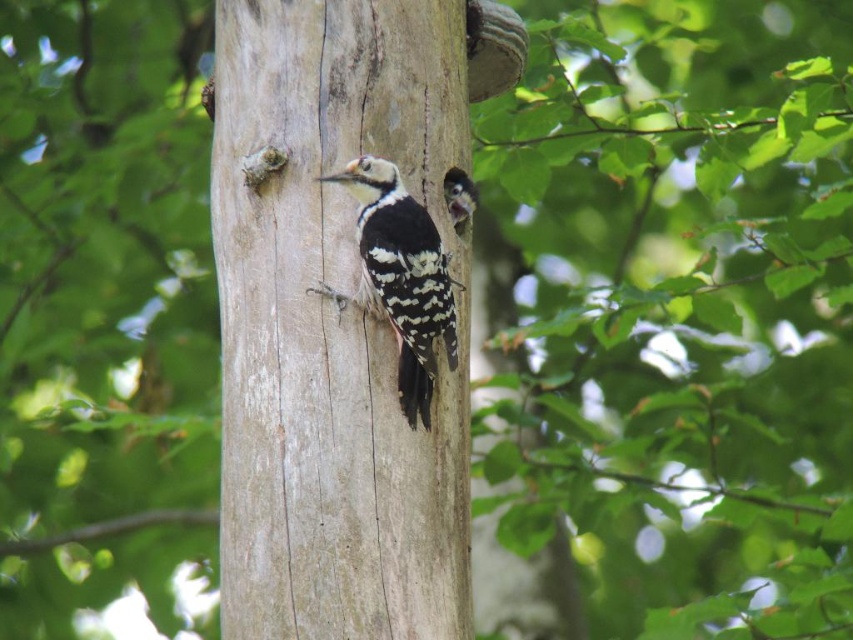
Is smooth gray wood at center thinner than white speckled woodpecker at center?

Incorrect, smooth gray wood at center's width is not less than white speckled woodpecker at center's.

The width and height of the screenshot is (853, 640). What do you see at coordinates (332, 326) in the screenshot? I see `smooth gray wood at center` at bounding box center [332, 326].

The height and width of the screenshot is (640, 853). Identify the location of smooth gray wood at center. (332, 326).